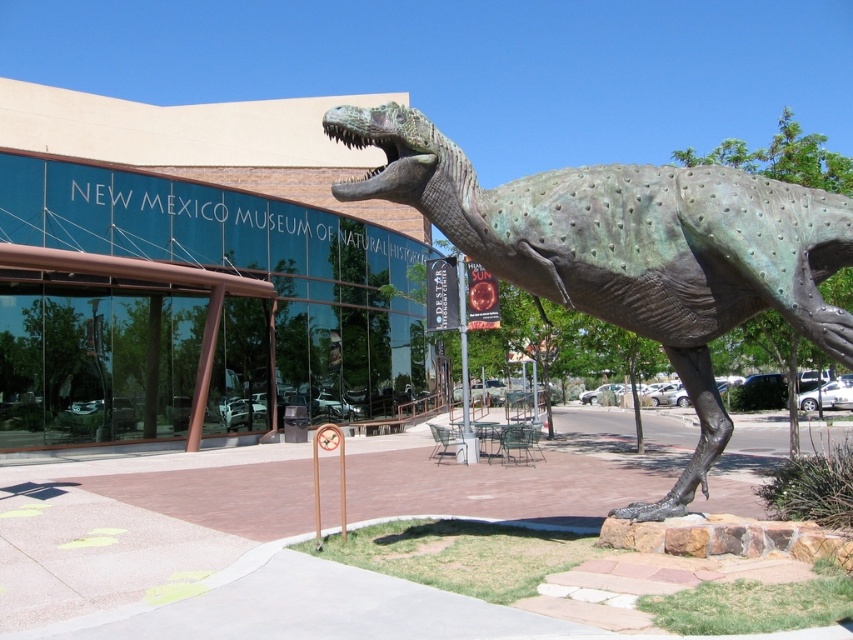
Question: Is green metallic dinosaur at right to the right of green polished stone dinosaur at center from the viewer's perspective?

Choices:
 (A) no
 (B) yes

Answer: (A)

Question: Is green metallic dinosaur at right positioned behind green polished stone dinosaur at center?

Choices:
 (A) no
 (B) yes

Answer: (B)

Question: Among these objects, which one is farthest from the camera?

Choices:
 (A) green metallic dinosaur at right
 (B) green polished stone dinosaur at center

Answer: (A)

Question: Which object is farther from the camera taking this photo?

Choices:
 (A) green polished stone dinosaur at center
 (B) green metallic dinosaur at right

Answer: (B)

Question: Does green metallic dinosaur at right appear over green polished stone dinosaur at center?

Choices:
 (A) no
 (B) yes

Answer: (B)

Question: Which point is farther to the camera?

Choices:
 (A) green polished stone dinosaur at center
 (B) green metallic dinosaur at right

Answer: (B)